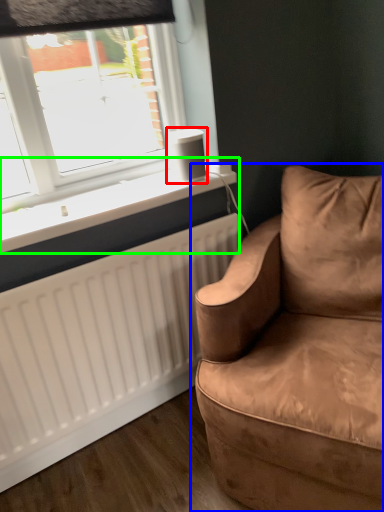
Question: Which object is the closest to the speaker (highlighted by a red box)? Choose among these: studio couch (highlighted by a blue box) or window sill (highlighted by a green box).

Choices:
 (A) studio couch
 (B) window sill

Answer: (B)